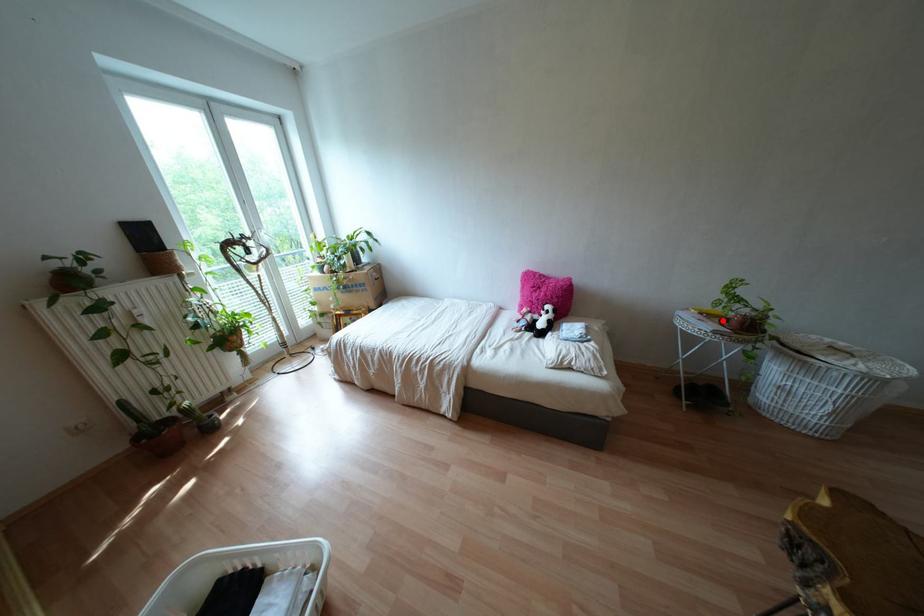
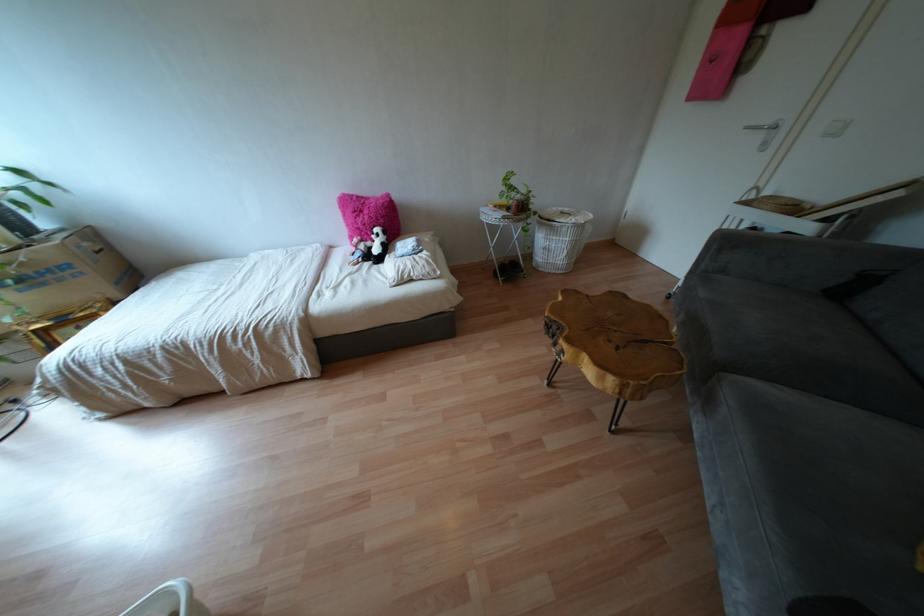
Question: I am providing you with two images of the same scene from different viewpoints. In image1, a red point is highlighted. Considering the same 3D point in image2, which of the following is correct?

Choices:
 (A) It is closer
 (B) It is farther

Answer: (A)